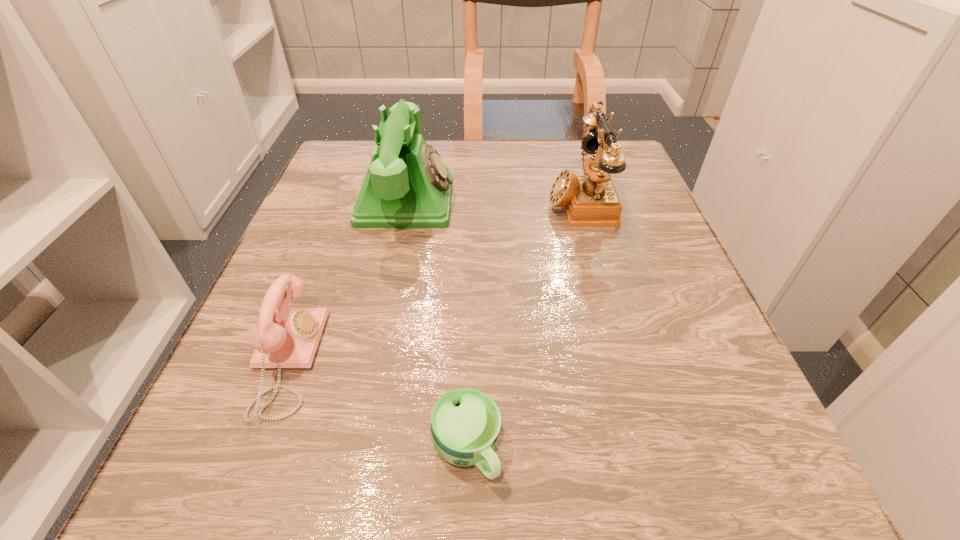
Locate an element on the screen. the rightmost telephone is located at coordinates (591, 199).

Find the location of a particular element. the nearest telephone is located at coordinates pos(285,337).

Locate an element on the screen. The height and width of the screenshot is (540, 960). the shortest telephone is located at coordinates (285, 337).

What are the coordinates of `cup` in the screenshot? It's located at (465, 423).

I want to click on vacant space located 0.060m on the dial number of the rightmost object, so click(517, 200).

You are a GUI agent. You are given a task and a screenshot of the screen. Output one action in this format:
    pyautogui.click(x=<x>, y=<y>)
    Task: Click on the free spot located 0.070m on the dial number of the rightmost object
    Image resolution: width=960 pixels, height=540 pixels.
    Given the screenshot: What is the action you would take?
    pyautogui.click(x=513, y=200)

This screenshot has width=960, height=540. I want to click on vacant area situated on the dial number of the rightmost object, so point(415,200).

The width and height of the screenshot is (960, 540). I want to click on free space located 0.400m on the dial of the nearest telephone, so click(x=602, y=360).

Where is `vacant area situated 0.230m on the right of the shortest object`? This screenshot has height=540, width=960. vacant area situated 0.230m on the right of the shortest object is located at coordinates (693, 449).

You are a GUI agent. You are given a task and a screenshot of the screen. Output one action in this format:
    pyautogui.click(x=<x>, y=<y>)
    Task: Click on the object located in the near edge section of the desktop
    
    Given the screenshot: What is the action you would take?
    pyautogui.click(x=465, y=423)